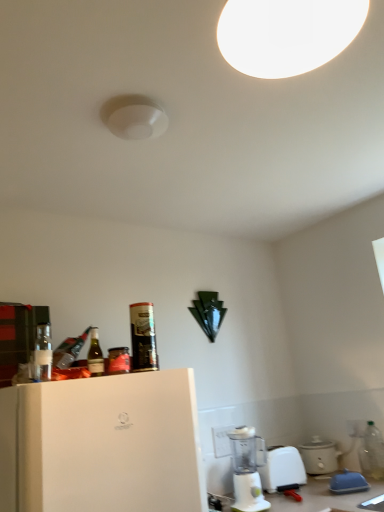
The image size is (384, 512). Find the location of `white matte light fixture at upper center`. white matte light fixture at upper center is located at coordinates (287, 34).

Image resolution: width=384 pixels, height=512 pixels. What do you see at coordinates (287, 34) in the screenshot? I see `white matte light fixture at upper center` at bounding box center [287, 34].

Measure the distance between white plastic electric outlet at lower center and camera.

The distance of white plastic electric outlet at lower center from camera is 2.12 meters.

You are a GUI agent. You are given a task and a screenshot of the screen. Output one action in this format:
    pyautogui.click(x=<x>, y=<y>)
    Task: Click on the white matte light fixture at upper center
    
    Given the screenshot: What is the action you would take?
    pyautogui.click(x=287, y=34)

Which is more to the right, metallic can at upper left, marked as the third bottle in a left-to-right arrangement, or blue plastic butter dish at lower right, which is the second appliance from back to front?

From the viewer's perspective, blue plastic butter dish at lower right, which is the second appliance from back to front, appears more on the right side.

Between metallic can at upper left, marked as the third bottle in a left-to-right arrangement, and blue plastic butter dish at lower right, which is the first appliance in front-to-back order, which one has smaller size?

blue plastic butter dish at lower right, which is the first appliance in front-to-back order, is smaller.

From the image's perspective, between metallic can at upper left, the 2th bottle in the right-to-left sequence, and blue plastic butter dish at lower right, which is the second appliance from back to front, which one is located above?

From the image's view, metallic can at upper left, the 2th bottle in the right-to-left sequence, is above.

Between white plastic blender at lower center and white matte refrigerator at left, which one appears on the right side from the viewer's perspective?

white plastic blender at lower center.

In the scene shown: Is white plastic blender at lower center not near white matte refrigerator at left?

white plastic blender at lower center is far away from white matte refrigerator at left.

From a real-world perspective, is white plastic blender at lower center physically located above or below white matte refrigerator at left?

Clearly, from a real-world perspective, white plastic blender at lower center is below white matte refrigerator at left.

Is white matte refrigerator at left a part of white plastic blender at lower center?

No.

Consider the image. From the image's perspective, between matte white slow cooker at lower right, which appears as the 2th appliance when viewed from the front, and white plastic blender at lower center, who is located below?

matte white slow cooker at lower right, which appears as the 2th appliance when viewed from the front.

Is matte white slow cooker at lower right, which appears as the 2th appliance when viewed from the front, not close to white plastic blender at lower center?

No, matte white slow cooker at lower right, which appears as the 2th appliance when viewed from the front, is in close proximity to white plastic blender at lower center.

Which is behind, matte white slow cooker at lower right, which appears as the 2th appliance when viewed from the front, or white plastic blender at lower center?

matte white slow cooker at lower right, which appears as the 2th appliance when viewed from the front, is further from the camera.

From the image's perspective, is clear plastic bottle at lower right, placed as the fourth bottle when sorted from top to bottom, on top of clear glass bottle at left, acting as the 4th bottle starting from the right?

Incorrect, from the image's perspective, clear plastic bottle at lower right, placed as the fourth bottle when sorted from top to bottom, is lower than clear glass bottle at left, acting as the 4th bottle starting from the right.

Is clear plastic bottle at lower right, placed as the first bottle when sorted from bottom to top, turned away from clear glass bottle at left, the 2th bottle in the bottom-to-top sequence?

That's not correct — clear plastic bottle at lower right, placed as the first bottle when sorted from bottom to top, is not looking away from clear glass bottle at left, the 2th bottle in the bottom-to-top sequence.

Considering the relative sizes of clear plastic bottle at lower right, placed as the fourth bottle when sorted from top to bottom, and clear glass bottle at left, which is counted as the first bottle, starting from the front, in the image provided, is clear plastic bottle at lower right, placed as the fourth bottle when sorted from top to bottom, shorter than clear glass bottle at left, which is counted as the first bottle, starting from the front,?

Incorrect, the height of clear plastic bottle at lower right, placed as the fourth bottle when sorted from top to bottom, does not fall short of that of clear glass bottle at left, which is counted as the first bottle, starting from the front.

Looking at this image, which object is positioned more to the right, clear plastic bottle at lower right, placed as the fourth bottle when sorted from top to bottom, or clear glass bottle at left, arranged as the 1th bottle when viewed from the left?

clear plastic bottle at lower right, placed as the fourth bottle when sorted from top to bottom, is more to the right.

Is white matte refrigerator at left touching white matte light fixture at upper center?

No, white matte refrigerator at left is not next to white matte light fixture at upper center.

From a real-world perspective, does white matte refrigerator at left stand above white matte light fixture at upper center?

Incorrect, from a real-world perspective, white matte refrigerator at left is lower than white matte light fixture at upper center.

Which is in front, point (83, 472) or point (302, 45)?

The point (302, 45) is more forward.

How many degrees apart are the facing directions of white matte refrigerator at left and white matte light fixture at upper center?

There is a 90-degree angle between the facing directions of white matte refrigerator at left and white matte light fixture at upper center.

Between point (215, 454) and point (339, 485), which one is positioned in front?

The point (339, 485) is more forward.

Between white plastic electric outlet at lower center and blue plastic butter dish at lower right, which is the second appliance from back to front, which one has larger size?

Bigger between the two is blue plastic butter dish at lower right, which is the second appliance from back to front.

From the image's perspective, is white plastic electric outlet at lower center positioned above or below blue plastic butter dish at lower right, which is the first appliance in front-to-back order?

white plastic electric outlet at lower center is above blue plastic butter dish at lower right, which is the first appliance in front-to-back order.

This screenshot has height=512, width=384. Find the location of `electric outlet above the blue plastic butter dish at lower right, which is the first appliance in front-to-back order (from the image's perspective)`. electric outlet above the blue plastic butter dish at lower right, which is the first appliance in front-to-back order (from the image's perspective) is located at coordinates (222, 441).

Between white plastic blender at lower center and matte white slow cooker at lower right, the 1th appliance in the back-to-front sequence, which one appears on the right side from the viewer's perspective?

Positioned to the right is matte white slow cooker at lower right, the 1th appliance in the back-to-front sequence.

Considering the sizes of objects white plastic blender at lower center and matte white slow cooker at lower right, the 1th appliance in the back-to-front sequence, in the image provided, who is wider, white plastic blender at lower center or matte white slow cooker at lower right, the 1th appliance in the back-to-front sequence,?

Wider between the two is matte white slow cooker at lower right, the 1th appliance in the back-to-front sequence.

Who is shorter, white plastic blender at lower center or matte white slow cooker at lower right, which appears as the 2th appliance when viewed from the front?

Standing shorter between the two is white plastic blender at lower center.

Is white plastic blender at lower center outside of matte white slow cooker at lower right, the 1th appliance in the back-to-front sequence?

Yes, white plastic blender at lower center is located beyond the bounds of matte white slow cooker at lower right, the 1th appliance in the back-to-front sequence.

From a real-world perspective, which bottle is the 4th one above the blue plastic butter dish at lower right, which is the first appliance in front-to-back order? Please provide its 2D coordinates.

[(143, 337)]

The height and width of the screenshot is (512, 384). What are the coordinates of `kitchen appliance behind the white matte refrigerator at left` in the screenshot? It's located at [x=282, y=469].

Looking at the image, which one is located further to blue plastic butter dish at lower right, which is the second appliance from back to front, matte white slow cooker at lower right, which appears as the 2th appliance when viewed from the front, or green glass bottle at left, the 2th bottle when ordered from left to right?

Among the two, green glass bottle at left, the 2th bottle when ordered from left to right, is located further to blue plastic butter dish at lower right, which is the second appliance from back to front.

Which object lies further to the anchor point blue plastic butter dish at lower right, which is the second appliance from back to front, white plastic electric outlet at lower center or matte white slow cooker at lower right, which appears as the 2th appliance when viewed from the front?

The object further to blue plastic butter dish at lower right, which is the second appliance from back to front, is white plastic electric outlet at lower center.

In the scene shown: Looking at the image, which one is located further to metallic can at upper left, positioned as the 1th bottle in top-to-bottom order, blue plastic butter dish at lower right, which is the second appliance from back to front, or white plastic blender at lower center?

Among the two, blue plastic butter dish at lower right, which is the second appliance from back to front, is located further to metallic can at upper left, positioned as the 1th bottle in top-to-bottom order.

From the image, which object appears to be farther from metallic can at upper left, marked as the 2th bottle in a back-to-front arrangement, clear glass bottle at left, arranged as the 1th bottle when viewed from the left, or white plastic blender at lower center?

Among the two, white plastic blender at lower center is located further to metallic can at upper left, marked as the 2th bottle in a back-to-front arrangement.

Looking at this image, based on their spatial positions, is matte white slow cooker at lower right, the 1th appliance in the back-to-front sequence, or white plastic electric outlet at lower center further from metallic can at upper left, marked as the third bottle in a left-to-right arrangement?

Based on the image, matte white slow cooker at lower right, the 1th appliance in the back-to-front sequence, appears to be further to metallic can at upper left, marked as the third bottle in a left-to-right arrangement.

When comparing their distances from green glass bottle at left, the 2th bottle viewed from the top, does matte white slow cooker at lower right, the 1th appliance in the back-to-front sequence, or white plastic blender at lower center seem further?

The object further to green glass bottle at left, the 2th bottle viewed from the top, is matte white slow cooker at lower right, the 1th appliance in the back-to-front sequence.

Looking at the image, which one is located further to white plastic blender at lower center, white matte refrigerator at left or metallic can at upper left, the 2th bottle in the right-to-left sequence?

metallic can at upper left, the 2th bottle in the right-to-left sequence, is further to white plastic blender at lower center.

Which object lies further to the anchor point white matte refrigerator at left, blue plastic butter dish at lower right, which is the second appliance from back to front, or white plastic blender at lower center?

Based on the image, blue plastic butter dish at lower right, which is the second appliance from back to front, appears to be further to white matte refrigerator at left.

At what (x,y) coordinates should I click in order to perform the action: click on home appliance between white matte light fixture at upper center and clear plastic bottle at lower right, placed as the first bottle when sorted from bottom to top, from top to bottom. Please return your answer as a coordinate pair (x, y). Looking at the image, I should click on (102, 444).

Identify the location of beverage located between green glass bottle at left, the third bottle ordered from the bottom, and blue plastic butter dish at lower right, which is the first appliance in front-to-back order, in the left-right direction. (118, 360).

Find the location of `appliance between white matte light fixture at upper center and white plastic blender at lower center in the up-down direction`. appliance between white matte light fixture at upper center and white plastic blender at lower center in the up-down direction is located at coordinates click(348, 482).

The height and width of the screenshot is (512, 384). I want to click on blender between white matte refrigerator at left and blue plastic butter dish at lower right, which is the first appliance in front-to-back order, so click(x=247, y=469).